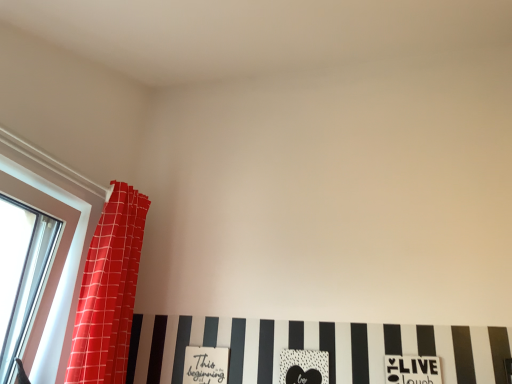
Find the location of `red fabric curtain at left`. red fabric curtain at left is located at coordinates (109, 291).

In order to face matte white sign at lower center, which is the third print from right to left, should I rotate leftwards or rightwards?

Rotate left and turn 6.934 degrees.

Find the location of a particular element. This screenshot has width=512, height=384. matte white sign at lower center, which is the 1th print in left-to-right order is located at coordinates (206, 365).

Identify the location of clear glass window at left. The width and height of the screenshot is (512, 384). (69, 249).

From the image's perspective, is matte white sign at lower center, which is the third print from right to left, located beneath white matte print at lower center, the third print from the left?

Correct, matte white sign at lower center, which is the third print from right to left, appears lower than white matte print at lower center, the third print from the left, in the image.

Considering the sizes of objects matte white sign at lower center, which is the 1th print in left-to-right order, and white matte print at lower center, the third print from the left, in the image provided, who is taller, matte white sign at lower center, which is the 1th print in left-to-right order, or white matte print at lower center, the third print from the left,?

With more height is white matte print at lower center, the third print from the left.

Could you tell me if matte white sign at lower center, which is the third print from right to left, is facing white matte print at lower center, the third print from the left?

No, matte white sign at lower center, which is the third print from right to left, is not facing towards white matte print at lower center, the third print from the left.

Is matte white sign at lower center, which is the third print from right to left, not near white matte print at lower center, the 1th print in the right-to-left sequence?

That's not correct — matte white sign at lower center, which is the third print from right to left, is a little close to white matte print at lower center, the 1th print in the right-to-left sequence.

Which is more to the right, black matte heart at center, placed as the second print when sorted from right to left, or matte white sign at lower center, which is the 1th print in left-to-right order?

Positioned to the right is black matte heart at center, placed as the second print when sorted from right to left.

Does black matte heart at center, placed as the second print when sorted from left to right, have a greater height compared to matte white sign at lower center, which is the third print from right to left?

No, black matte heart at center, placed as the second print when sorted from left to right, is not taller than matte white sign at lower center, which is the third print from right to left.

Does black matte heart at center, placed as the second print when sorted from right to left, turn towards matte white sign at lower center, which is the 1th print in left-to-right order?

No, black matte heart at center, placed as the second print when sorted from right to left, is not facing towards matte white sign at lower center, which is the 1th print in left-to-right order.

Considering the sizes of objects black matte heart at center, placed as the second print when sorted from left to right, and matte white sign at lower center, which is the 1th print in left-to-right order, in the image provided, who is bigger, black matte heart at center, placed as the second print when sorted from left to right, or matte white sign at lower center, which is the 1th print in left-to-right order,?

With larger size is black matte heart at center, placed as the second print when sorted from left to right.

At what (x,y) coordinates should I click in order to perform the action: click on print that is the 1st one when counting backward from the white matte print at lower center, the third print from the left. Please return your answer as a coordinate pair (x, y). Image resolution: width=512 pixels, height=384 pixels. Looking at the image, I should click on (304, 367).

Can you confirm if black matte heart at center, placed as the second print when sorted from right to left, is smaller than white matte print at lower center, the 1th print in the right-to-left sequence?

Correct, black matte heart at center, placed as the second print when sorted from right to left, occupies less space than white matte print at lower center, the 1th print in the right-to-left sequence.

Considering the positions of objects black matte heart at center, placed as the second print when sorted from right to left, and white matte print at lower center, the 1th print in the right-to-left sequence, in the image provided, who is behind, black matte heart at center, placed as the second print when sorted from right to left, or white matte print at lower center, the 1th print in the right-to-left sequence,?

black matte heart at center, placed as the second print when sorted from right to left, is more distant.

Is point (295, 355) closer to viewer compared to point (416, 358)?

That is False.

From the image's perspective, which is below, black matte heart at center, placed as the second print when sorted from left to right, or clear glass window at left?

black matte heart at center, placed as the second print when sorted from left to right, from the image's perspective.

Which is in front, point (281, 374) or point (61, 345)?

The point (61, 345) is more forward.

From a real-world perspective, is black matte heart at center, placed as the second print when sorted from left to right, physically located above or below clear glass window at left?

black matte heart at center, placed as the second print when sorted from left to right, is situated lower than clear glass window at left in the real world.

Is red fabric curtain at left to the right of clear glass window at left from the viewer's perspective?

Indeed, red fabric curtain at left is positioned on the right side of clear glass window at left.

Is red fabric curtain at left inside the boundaries of clear glass window at left, or outside?

The correct answer is: outside.

Can you confirm if red fabric curtain at left is bigger than clear glass window at left?

Indeed, red fabric curtain at left has a larger size compared to clear glass window at left.

Does point (96, 376) appear closer or farther from the camera than point (6, 167)?

Point (96, 376).

Which object is thinner, red fabric curtain at left or black matte heart at center, placed as the second print when sorted from left to right?

black matte heart at center, placed as the second print when sorted from left to right, is thinner.

Considering the positions of objects red fabric curtain at left and black matte heart at center, placed as the second print when sorted from left to right, in the image provided, who is more to the right, red fabric curtain at left or black matte heart at center, placed as the second print when sorted from left to right,?

black matte heart at center, placed as the second print when sorted from left to right.

Is the position of red fabric curtain at left more distant than that of black matte heart at center, placed as the second print when sorted from left to right?

No, it is not.

From a real-world perspective, is red fabric curtain at left positioned over black matte heart at center, placed as the second print when sorted from right to left, based on gravity?

Yes, from a real-world perspective, red fabric curtain at left is above black matte heart at center, placed as the second print when sorted from right to left.

In the image, is black matte heart at center, placed as the second print when sorted from right to left, positioned in front of or behind red fabric curtain at left?

In the image, black matte heart at center, placed as the second print when sorted from right to left, appears behind red fabric curtain at left.

Which of these two, black matte heart at center, placed as the second print when sorted from right to left, or red fabric curtain at left, stands taller?

With more height is red fabric curtain at left.

From the image's perspective, is black matte heart at center, placed as the second print when sorted from right to left, over red fabric curtain at left?

No, from the image's perspective, black matte heart at center, placed as the second print when sorted from right to left, is not on top of red fabric curtain at left.

Which of these two, black matte heart at center, placed as the second print when sorted from right to left, or red fabric curtain at left, is bigger?

red fabric curtain at left is bigger.

In order to click on the 2nd print in front of the matte white sign at lower center, which is the 1th print in left-to-right order, counting from the anchor's position in this screenshot , I will do `click(412, 370)`.

From the image's perspective, which print is the 1st one above the matte white sign at lower center, which is the third print from right to left? Please provide its 2D coordinates.

[(304, 367)]

Based on the photo, which object lies nearer to the anchor point matte white sign at lower center, which is the third print from right to left, red fabric curtain at left or clear glass window at left?

red fabric curtain at left is positioned closer to the anchor matte white sign at lower center, which is the third print from right to left.

When comparing their distances from matte white sign at lower center, which is the third print from right to left, does red fabric curtain at left or white matte print at lower center, the third print from the left, seem closer?

red fabric curtain at left is closer to matte white sign at lower center, which is the third print from right to left.

From the image, which object appears to be nearer to black matte heart at center, placed as the second print when sorted from left to right, matte white sign at lower center, which is the 1th print in left-to-right order, or white matte print at lower center, the 1th print in the right-to-left sequence?

Among the two, white matte print at lower center, the 1th print in the right-to-left sequence, is located nearer to black matte heart at center, placed as the second print when sorted from left to right.

From the image, which object appears to be nearer to black matte heart at center, placed as the second print when sorted from right to left, clear glass window at left or matte white sign at lower center, which is the third print from right to left?

matte white sign at lower center, which is the third print from right to left, lies closer to black matte heart at center, placed as the second print when sorted from right to left, than the other object.

When comparing their distances from black matte heart at center, placed as the second print when sorted from left to right, does red fabric curtain at left or clear glass window at left seem closer?

red fabric curtain at left.

When comparing their distances from red fabric curtain at left, does matte white sign at lower center, which is the third print from right to left, or white matte print at lower center, the third print from the left, seem closer?

matte white sign at lower center, which is the third print from right to left.

Looking at the image, which one is located closer to white matte print at lower center, the third print from the left, red fabric curtain at left or matte white sign at lower center, which is the 1th print in left-to-right order?

matte white sign at lower center, which is the 1th print in left-to-right order.

Considering their positions, is black matte heart at center, placed as the second print when sorted from left to right, positioned further to white matte print at lower center, the third print from the left, than clear glass window at left?

clear glass window at left is positioned further to the anchor white matte print at lower center, the third print from the left.

Where is `curtain between clear glass window at left and matte white sign at lower center, which is the third print from right to left, in the horizontal direction`? curtain between clear glass window at left and matte white sign at lower center, which is the third print from right to left, in the horizontal direction is located at coordinates tap(109, 291).

Where is `print between matte white sign at lower center, which is the third print from right to left, and white matte print at lower center, the 1th print in the right-to-left sequence`? This screenshot has width=512, height=384. print between matte white sign at lower center, which is the third print from right to left, and white matte print at lower center, the 1th print in the right-to-left sequence is located at coordinates point(304,367).

You are a GUI agent. You are given a task and a screenshot of the screen. Output one action in this format:
    pyautogui.click(x=<x>, y=<y>)
    Task: Click on the print situated between clear glass window at left and black matte heart at center, placed as the second print when sorted from left to right, from left to right
    This screenshot has height=384, width=512.
    Given the screenshot: What is the action you would take?
    pyautogui.click(x=206, y=365)

Identify the location of curtain between clear glass window at left and black matte heart at center, placed as the second print when sorted from right to left. The width and height of the screenshot is (512, 384). (109, 291).